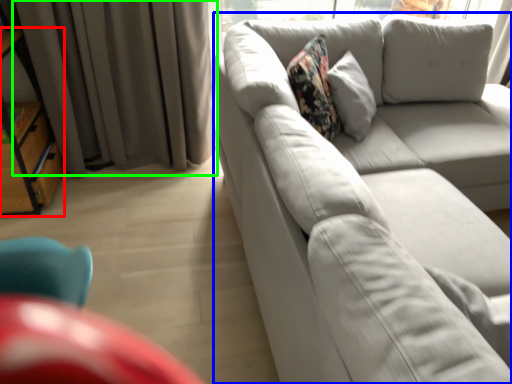
Question: Estimate the real-world distances between objects in this image. Which object is farther from bookshelf (highlighted by a red box), studio couch (highlighted by a blue box) or curtain (highlighted by a green box)?

Choices:
 (A) studio couch
 (B) curtain

Answer: (A)